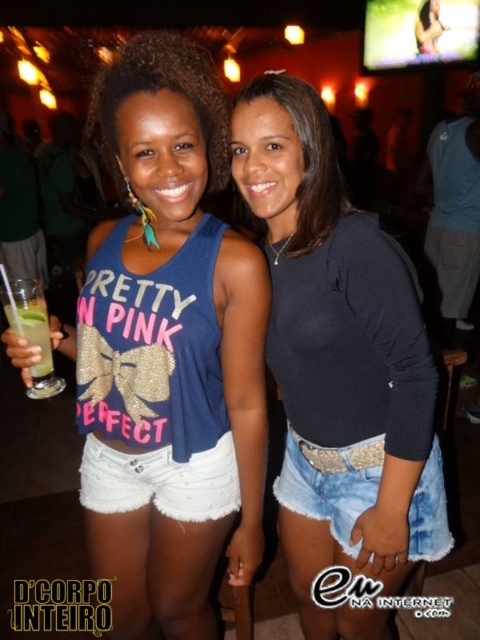
Can you confirm if black matte shirt at center is positioned above white denim shorts at lower center?

Indeed, black matte shirt at center is positioned over white denim shorts at lower center.

Between point (290, 310) and point (200, 467), which one is positioned in front?

Point (290, 310)

Where is `black matte shirt at center`? black matte shirt at center is located at coordinates (339, 364).

Is matte black tank top at upper center to the right of green translucent glass at left from the viewer's perspective?

Correct, you'll find matte black tank top at upper center to the right of green translucent glass at left.

In the scene shown: Does matte black tank top at upper center lie behind green translucent glass at left?

That is False.

Identify the location of matte black tank top at upper center. (159, 90).

Who is higher up, matte blue tank top at center or denim shorts at lower right?

matte blue tank top at center is above.

Image resolution: width=480 pixels, height=640 pixels. Identify the location of matte blue tank top at center. [x=168, y=353].

Between point (235, 406) and point (447, 547), which one is positioned in front?

Point (235, 406)

Locate an element on the screen. This screenshot has width=480, height=640. matte blue tank top at center is located at coordinates (168, 353).